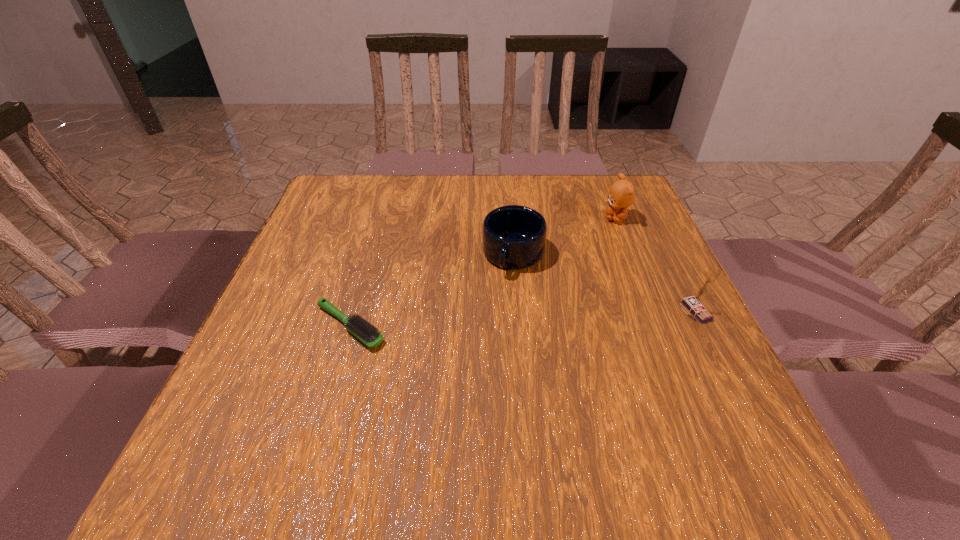
Find the location of `empty space between the mug and the rightmost object`. empty space between the mug and the rightmost object is located at coordinates (604, 283).

At what (x,y) coordinates should I click in order to perform the action: click on unoccupied area between the farthest object and the matchbox. Please return your answer as a coordinate pair (x, y). Image resolution: width=960 pixels, height=540 pixels. Looking at the image, I should click on (656, 265).

Locate an element on the screen. The width and height of the screenshot is (960, 540). vacant area that lies between the second object from right to left and the leftmost object is located at coordinates click(483, 272).

Where is `free spot between the leftmost object and the third tallest object`? free spot between the leftmost object and the third tallest object is located at coordinates (432, 291).

In order to click on free space between the matchbox and the teddy bear in this screenshot , I will do `click(656, 265)`.

You are a GUI agent. You are given a task and a screenshot of the screen. Output one action in this format:
    pyautogui.click(x=<x>, y=<y>)
    Task: Click on the free space between the second farthest object and the rightmost object
    The image size is (960, 540).
    Given the screenshot: What is the action you would take?
    pyautogui.click(x=604, y=283)

This screenshot has width=960, height=540. Find the location of `vacant space that is in between the rightmost object and the second shortest object`. vacant space that is in between the rightmost object and the second shortest object is located at coordinates [x=604, y=283].

Choose which object is the second nearest neighbor to the matchbox. Please provide its 2D coordinates. Your answer should be formatted as a tuple, i.e. [(x, y)], where the tuple contains the x and y coordinates of a point satisfying the conditions above.

[(513, 237)]

Where is `object that is the second nearest to the rightmost object`? The image size is (960, 540). object that is the second nearest to the rightmost object is located at coordinates (513, 237).

The width and height of the screenshot is (960, 540). I want to click on free location that satisfies the following two spatial constraints: 1. on the front side of the third nearest object; 2. on the left side of the matchbox, so click(x=518, y=311).